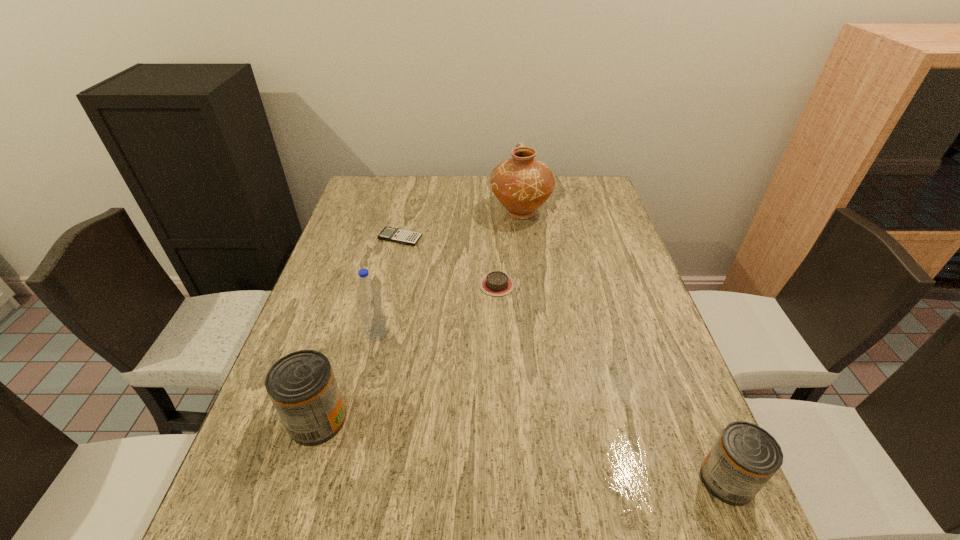
If we want them evenly spaced by inserting an extra can among them, please locate a free spot for this new can. Please provide its 2D coordinates. Your answer should be formatted as a tuple, i.e. [(x, y)], where the tuple contains the x and y coordinates of a point satisfying the conditions above.

[(511, 448)]